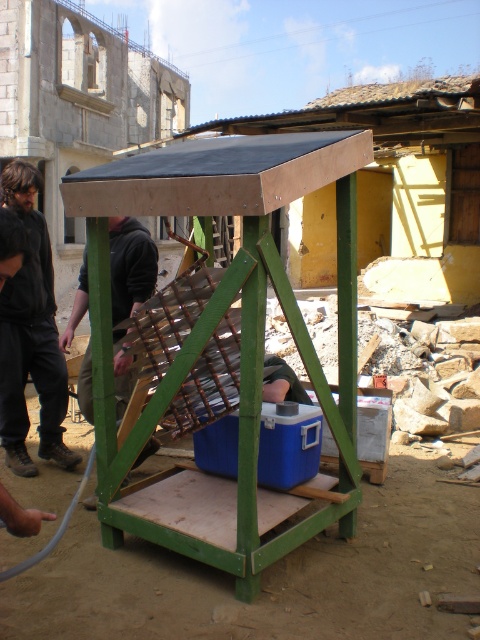
Question: Which point appears farthest from the camera in this image?

Choices:
 (A) (35, 308)
 (B) (115, 264)
 (C) (107, 506)

Answer: (A)

Question: Is the position of dark brown leather jacket at left less distant than that of dark gray hoodie at center?

Choices:
 (A) yes
 (B) no

Answer: (B)

Question: Which point is closer to the camera?

Choices:
 (A) tap(87, 346)
 (B) tap(228, 211)

Answer: (B)

Question: Is dark brown leather jacket at left positioned in front of dark gray hoodie at center?

Choices:
 (A) yes
 (B) no

Answer: (B)

Question: Estimate the real-world distances between objects in this image. Which object is farther from the dark brown leather jacket at left?

Choices:
 (A) wooden crate at center
 (B) dark gray hoodie at center

Answer: (A)

Question: Can you confirm if wooden crate at center is positioned to the left of dark gray hoodie at center?

Choices:
 (A) yes
 (B) no

Answer: (B)